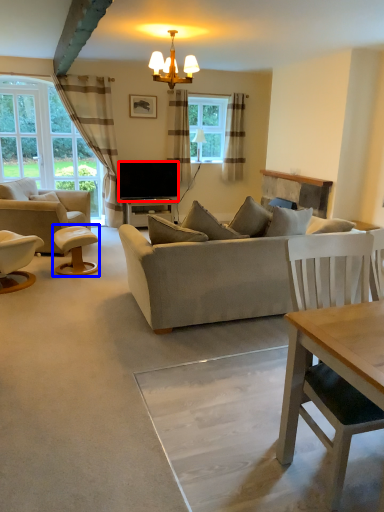
Question: Which object appears closest to the camera in this image, television (highlighted by a red box) or stool (highlighted by a blue box)?

Choices:
 (A) television
 (B) stool

Answer: (B)